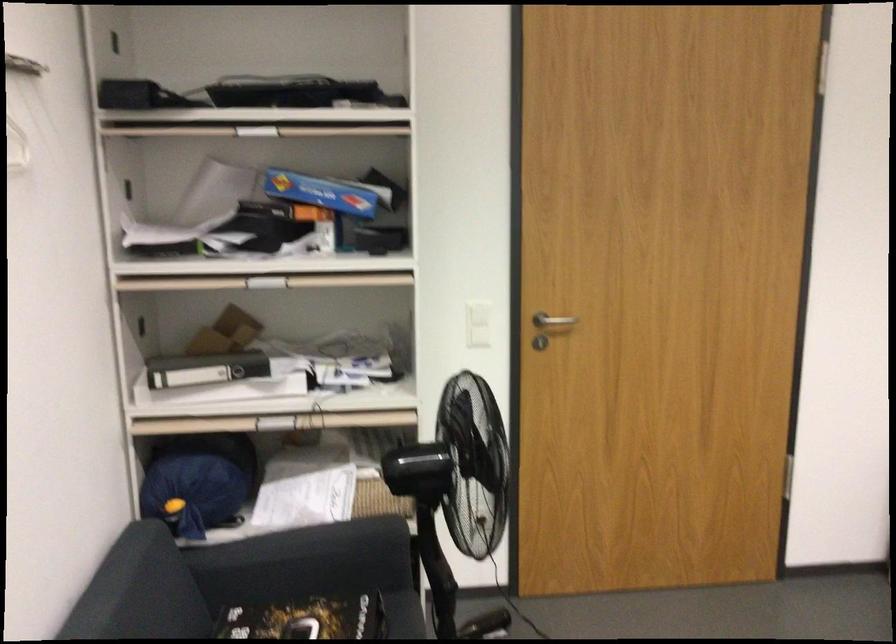
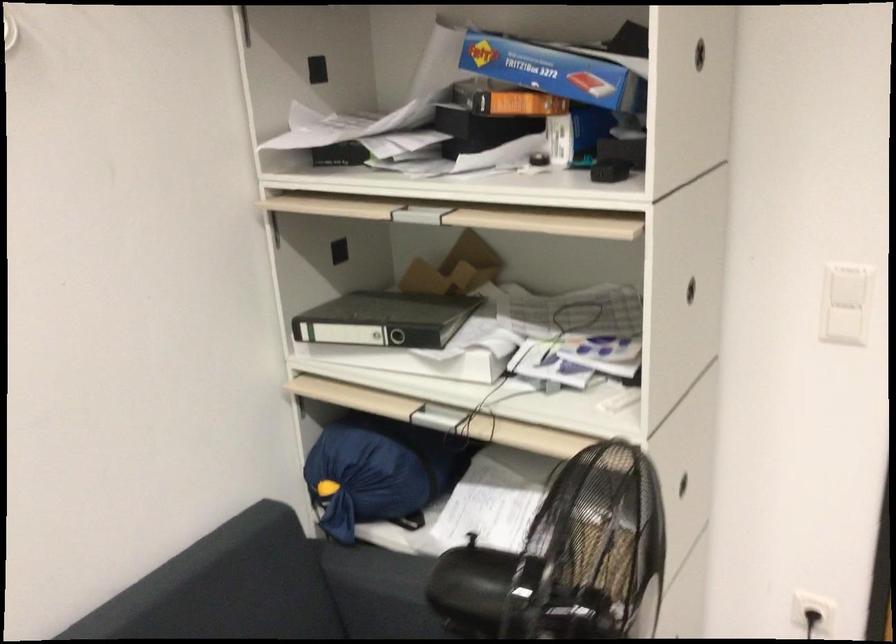
Find the pixel in the second image that matches point (332, 194) in the first image.

(553, 71)